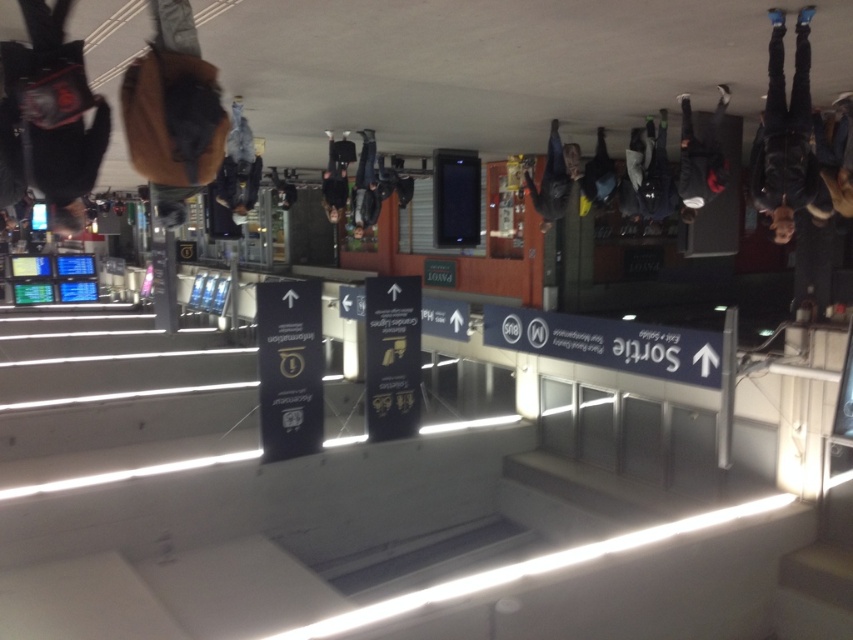
Is the position of brown fuzzy backpack at upper left less distant than that of dark gray fabric bag at upper center?

Yes.

Who is more forward, [160,193] or [659,152]?

Point [160,193]

You are a GUI agent. You are given a task and a screenshot of the screen. Output one action in this format:
    pyautogui.click(x=<x>, y=<y>)
    Task: Click on the brown fuzzy backpack at upper left
    
    Given the screenshot: What is the action you would take?
    pyautogui.click(x=164, y=90)

Who is higher up, matte brown backpack at upper left or brown fuzzy backpack at upper left?

matte brown backpack at upper left

Can you confirm if matte brown backpack at upper left is wider than brown fuzzy backpack at upper left?

Indeed, matte brown backpack at upper left has a greater width compared to brown fuzzy backpack at upper left.

Identify the location of matte brown backpack at upper left. The image size is (853, 640). (50, 113).

Image resolution: width=853 pixels, height=640 pixels. I want to click on matte brown backpack at upper left, so click(x=50, y=113).

Can you confirm if dark gray backpack at upper right is smaller than matte black bag at center?

Incorrect, dark gray backpack at upper right is not smaller in size than matte black bag at center.

Where is `dark gray backpack at upper right`? This screenshot has width=853, height=640. dark gray backpack at upper right is located at coordinates (701, 157).